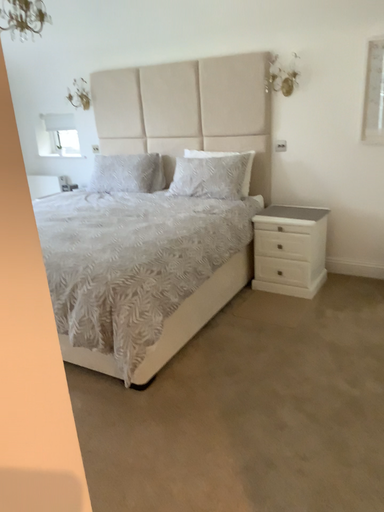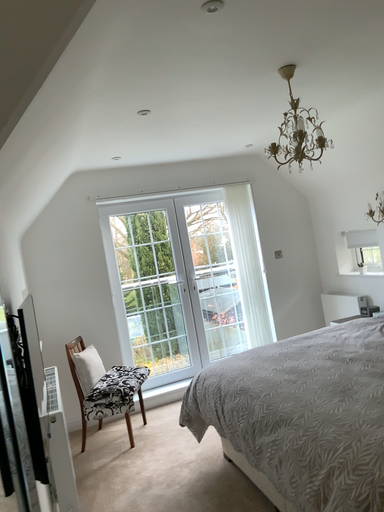
Question: Which way did the camera rotate in the video?

Choices:
 (A) rotated downward
 (B) rotated upward

Answer: (B)